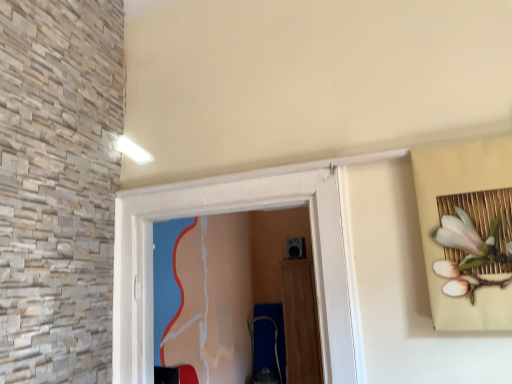
Where is `wooden door at center`? wooden door at center is located at coordinates (300, 323).

Describe the element at coordinates (300, 323) in the screenshot. The image size is (512, 384). I see `wooden door at center` at that location.

You are a GUI agent. You are given a task and a screenshot of the screen. Output one action in this format:
    pyautogui.click(x=<x>, y=<y>)
    Task: Click on the wooden door at center
    
    Given the screenshot: What is the action you would take?
    pyautogui.click(x=300, y=323)